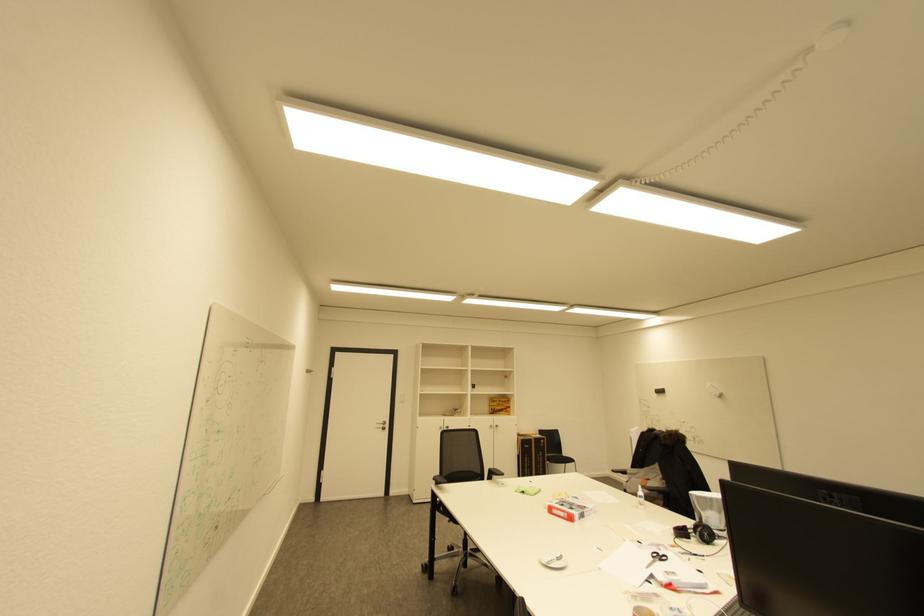
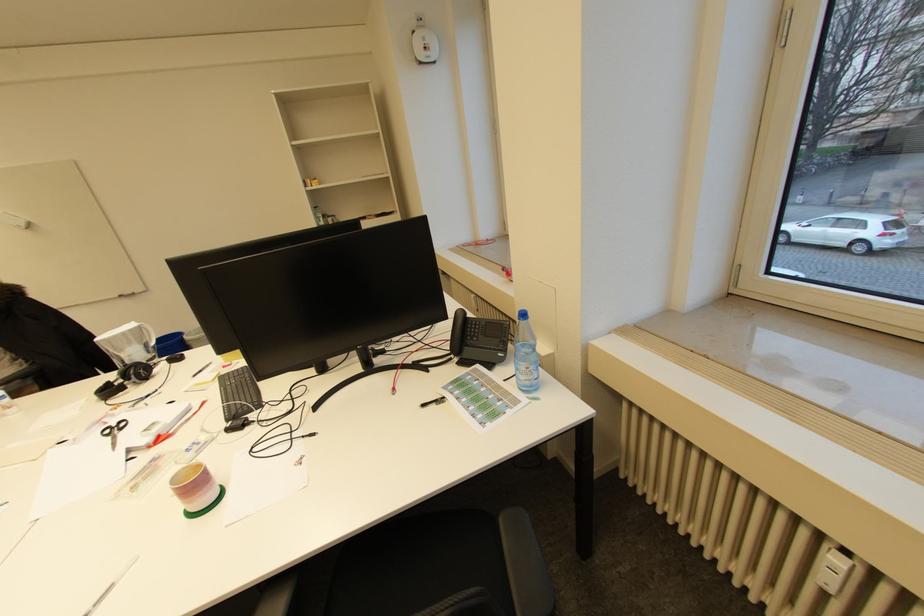
Find the pixel in the second image that matches the point at 716,499 in the first image.

(129, 334)